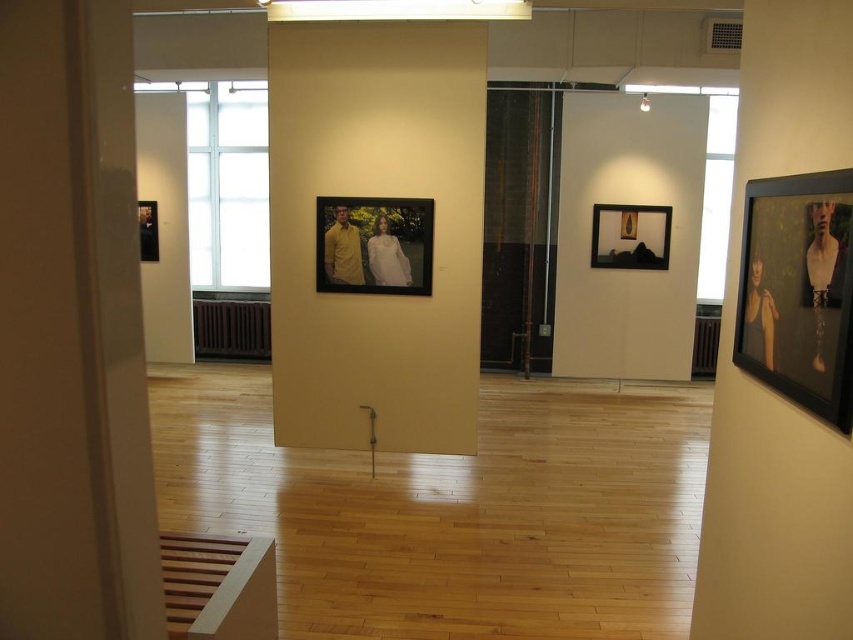
Question: Which of the following is the farthest from the observer?

Choices:
 (A) black matte picture frame at right
 (B) matte black portrait at left

Answer: (B)

Question: Is matte plastic picture frame at center above matte black picture frame at center?

Choices:
 (A) yes
 (B) no

Answer: (B)

Question: Does black matte picture frame at right have a greater width compared to matte black picture frame at center?

Choices:
 (A) yes
 (B) no

Answer: (B)

Question: Is matte plastic picture frame at center wider than matte black picture frame at center?

Choices:
 (A) yes
 (B) no

Answer: (B)

Question: Considering the real-world distances, which object is farthest from the matte black picture frame at center?

Choices:
 (A) black matte picture frame at right
 (B) matte plastic picture frame at center

Answer: (A)

Question: Which of the following is the farthest from the observer?

Choices:
 (A) (141, 259)
 (B) (833, 412)
 (C) (625, 236)
 (D) (405, 285)

Answer: (A)